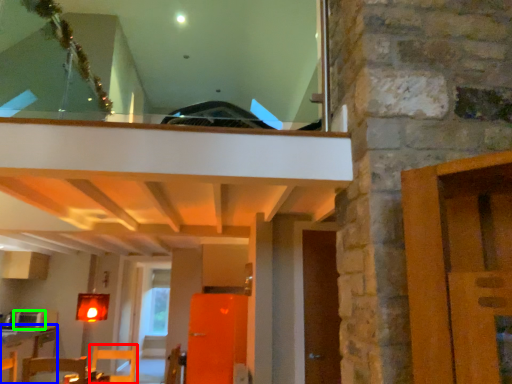
Question: Based on their relative distances, which object is farther from furniture (highlighted by a red box)? Choose from table (highlighted by a blue box) and appliance (highlighted by a green box).

Choices:
 (A) table
 (B) appliance

Answer: (B)